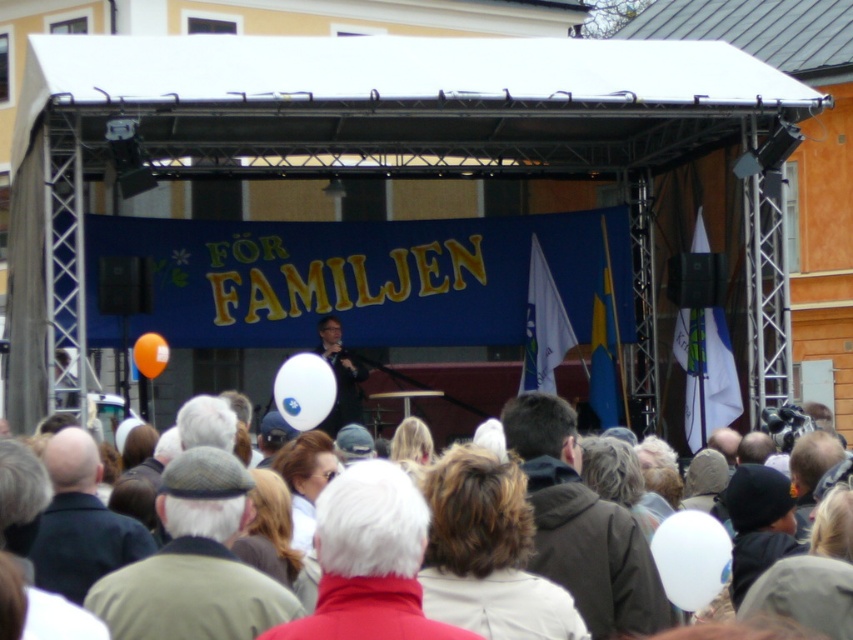
Which of these two, light brown hair at center or matte black microphone at center, stands shorter?

light brown hair at center

Is light brown hair at center thinner than matte black microphone at center?

Yes.

This screenshot has height=640, width=853. Identify the location of light brown hair at center. (486, 552).

The width and height of the screenshot is (853, 640). Describe the element at coordinates (194, 563) in the screenshot. I see `gray woolen cap at center` at that location.

Is gray woolen cap at center positioned before light brown hair at center?

Yes, it is in front of light brown hair at center.

Is point (270, 584) positioned after point (558, 586)?

No, (270, 584) is closer to viewer.

Identify the location of gray woolen cap at center. The width and height of the screenshot is (853, 640). (194, 563).

Between point (83, 484) and point (328, 420), which one is positioned behind?

The point (328, 420) is behind.

Is point (38, 577) positioned in front of point (329, 364)?

Yes.

Measure the distance between point (x=85, y=540) and camera.

A distance of 40.40 meters exists between point (x=85, y=540) and camera.

The width and height of the screenshot is (853, 640). In order to click on dark gray knit cap at lower left in this screenshot , I will do coord(80,522).